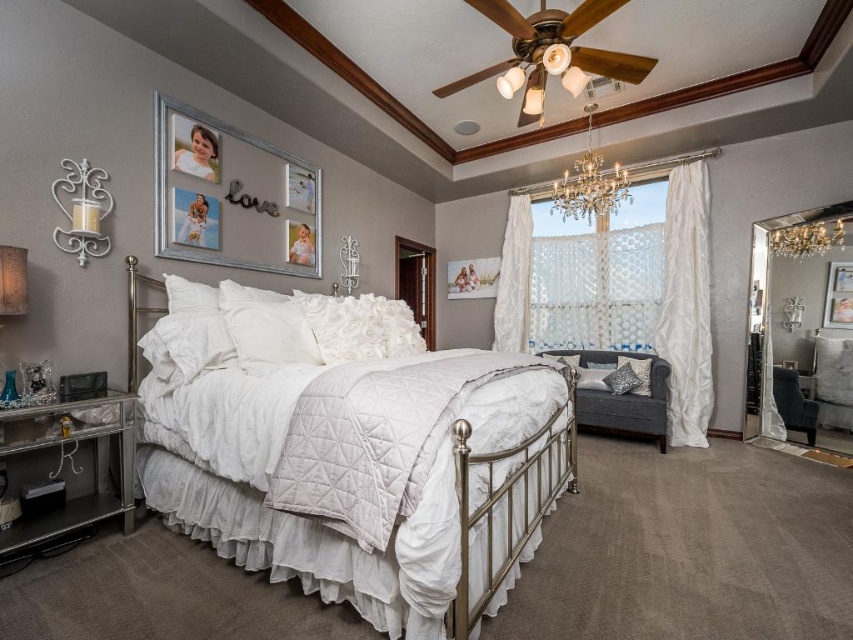
Is white quilted fabric bed at center taller than white textured curtain at right?

No, white quilted fabric bed at center is not taller than white textured curtain at right.

The height and width of the screenshot is (640, 853). What do you see at coordinates (354, 464) in the screenshot? I see `white quilted fabric bed at center` at bounding box center [354, 464].

What are the coordinates of `white quilted fabric bed at center` in the screenshot? It's located at (354, 464).

Does white lace curtain at center have a greater width compared to crystal glass chandelier at upper right?

Yes, white lace curtain at center is wider than crystal glass chandelier at upper right.

Can you confirm if white lace curtain at center is positioned to the left of crystal glass chandelier at upper right?

Indeed, white lace curtain at center is positioned on the left side of crystal glass chandelier at upper right.

Which is behind, point (517, 220) or point (817, 220)?

Point (517, 220)

Locate an element on the screen. white lace curtain at center is located at coordinates (514, 278).

Is crystal gold chandelier at upper center above metallic silver picture frame at upper right?

Correct, crystal gold chandelier at upper center is located above metallic silver picture frame at upper right.

Is crystal gold chandelier at upper center positioned at the back of metallic silver picture frame at upper right?

Yes.

Who is more forward, [596,170] or [849,289]?

Positioned in front is point [849,289].

Find the location of `crystal gold chandelier at upper center`. crystal gold chandelier at upper center is located at coordinates (589, 182).